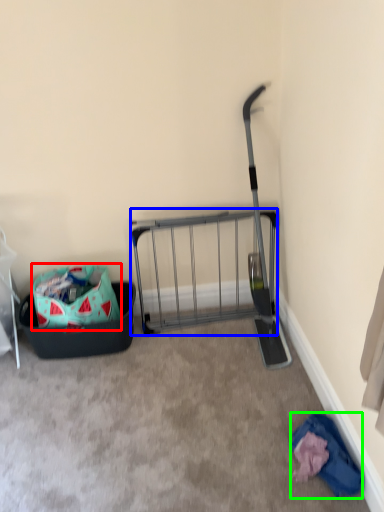
Question: Considering the real-world distances, which object is farthest from bag (highlighted by a red box)? cart (highlighted by a blue box) or clothing (highlighted by a green box)?

Choices:
 (A) cart
 (B) clothing

Answer: (B)